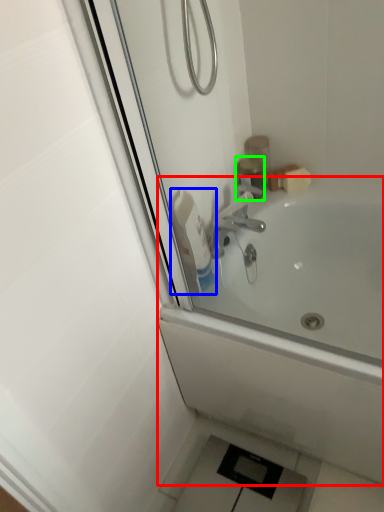
Question: Based on their relative distances, which object is nearer to bathtub (highlighted by a red box)? Choose from cleaning product (highlighted by a blue box) and toiletry (highlighted by a green box).

Choices:
 (A) cleaning product
 (B) toiletry

Answer: (A)